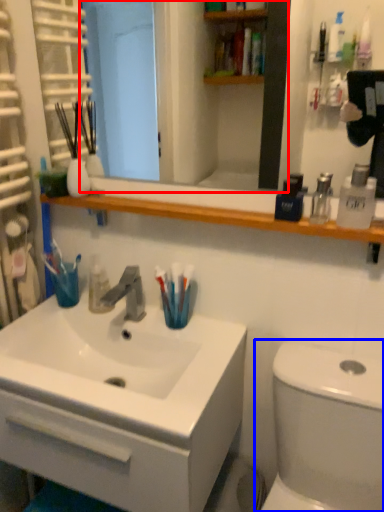
Question: Which object appears farthest to the camera in this image, mirror (highlighted by a red box) or toilet (highlighted by a blue box)?

Choices:
 (A) mirror
 (B) toilet

Answer: (A)